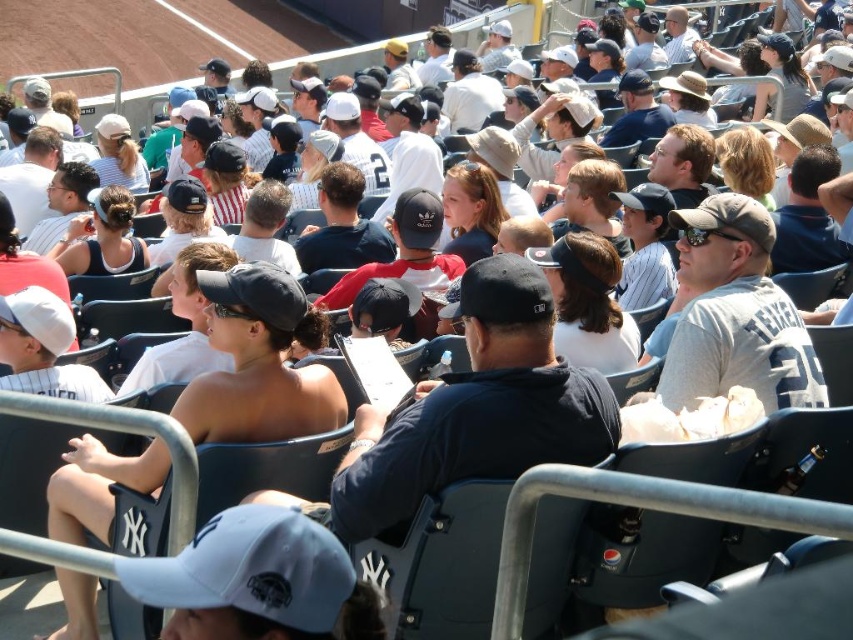
Does point (604, 244) lie behind point (256, 253)?

No, (604, 244) is in front of (256, 253).

Which is above, brown leather cap at center or dark brown hair at center?

dark brown hair at center is above.

Where is `brown leather cap at center`? brown leather cap at center is located at coordinates (587, 301).

Can you confirm if gray cotton t-shirt at center is positioned to the left of brown leather cap at center?

In fact, gray cotton t-shirt at center is to the right of brown leather cap at center.

Between point (764, 333) and point (587, 284), which one is positioned in front?

Point (764, 333) is more forward.

Where is `gray cotton t-shirt at center`? This screenshot has width=853, height=640. gray cotton t-shirt at center is located at coordinates (734, 314).

Between matte black cap at center and gray cotton t-shirt at center, which one appears on the right side from the viewer's perspective?

From the viewer's perspective, gray cotton t-shirt at center appears more on the right side.

Does point (318, 403) lie behind point (757, 209)?

No, it is not.

I want to click on matte black cap at center, so click(x=259, y=362).